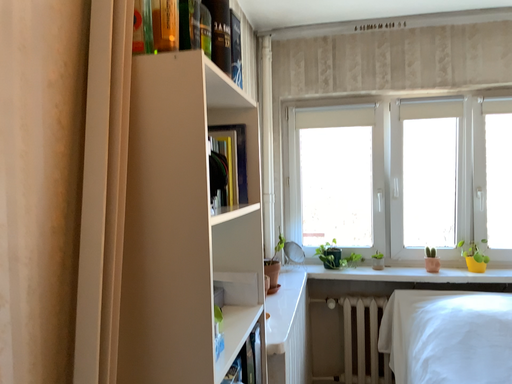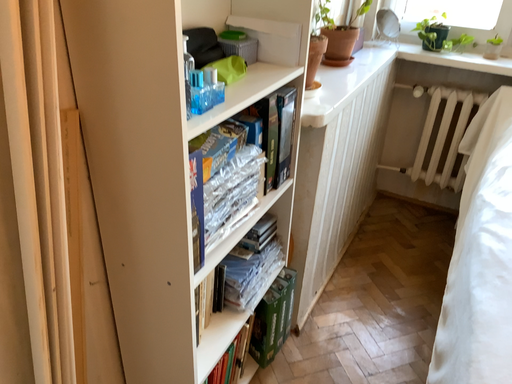
Question: How did the camera likely rotate when shooting the video?

Choices:
 (A) rotated left
 (B) rotated right

Answer: (A)